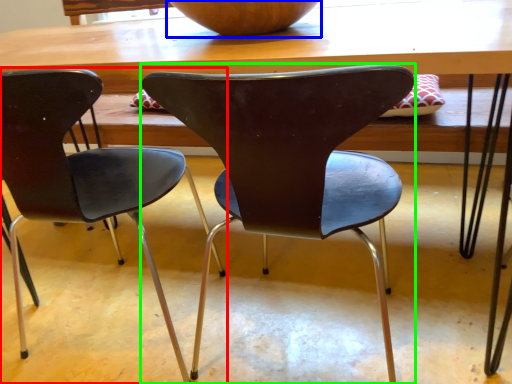
Question: Which object is the farthest from chair (highlighted by a red box)? Choose among these: bowl (highlighted by a blue box) or chair (highlighted by a green box).

Choices:
 (A) bowl
 (B) chair

Answer: (A)